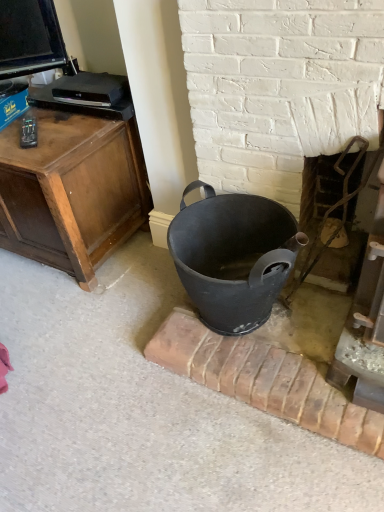
Locate an element on the screen. vacant region below matte black trash can at center (from a real-world perspective) is located at coordinates (255, 325).